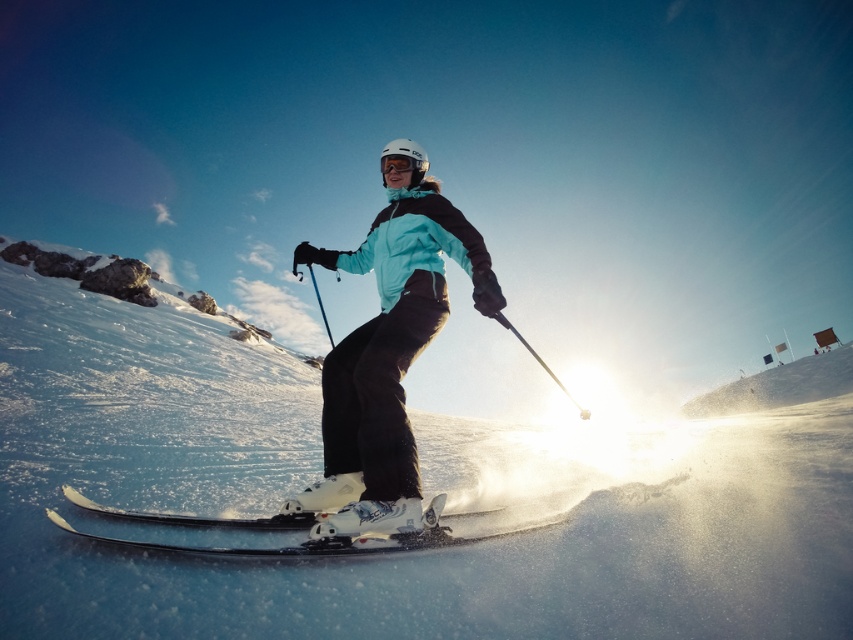
Can you confirm if metallic silver ski pole at center is positioned to the left of transparent plastic goggles at center?

Incorrect, metallic silver ski pole at center is not on the left side of transparent plastic goggles at center.

Looking at this image, can you confirm if metallic silver ski pole at center is positioned above transparent plastic goggles at center?

Actually, metallic silver ski pole at center is below transparent plastic goggles at center.

You are a GUI agent. You are given a task and a screenshot of the screen. Output one action in this format:
    pyautogui.click(x=<x>, y=<y>)
    Task: Click on the metallic silver ski pole at center
    
    Given the screenshot: What is the action you would take?
    (538, 362)

Between shiny metallic skis at center and transparent plastic goggles at center, which one is positioned higher?

Positioned higher is transparent plastic goggles at center.

In order to click on shiny metallic skis at center in this screenshot , I will do `click(334, 538)`.

What do you see at coordinates (387, 358) in the screenshot? Image resolution: width=853 pixels, height=640 pixels. I see `matte blue jacket at center` at bounding box center [387, 358].

Is point (409, 260) farther from viewer compared to point (498, 316)?

Yes, point (409, 260) is farther from viewer.

What do you see at coordinates (387, 358) in the screenshot? The height and width of the screenshot is (640, 853). I see `matte blue jacket at center` at bounding box center [387, 358].

Where is `matte blue jacket at center`? This screenshot has height=640, width=853. matte blue jacket at center is located at coordinates (387, 358).